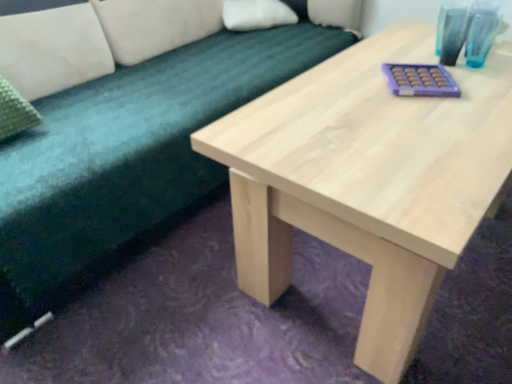
Question: From the image's perspective, relative to soft green fabric couch at upper left, is teal glass at upper right above or below?

Choices:
 (A) below
 (B) above

Answer: (B)

Question: Looking at their shapes, would you say teal glass at upper right is wider or thinner than soft green fabric couch at upper left?

Choices:
 (A) wide
 (B) thin

Answer: (B)

Question: Which object is the farthest from the white soft pillow at upper center?

Choices:
 (A) clear glass vase at upper right
 (B) natural wood table at center
 (C) soft green fabric couch at upper left
 (D) teal glass at upper right

Answer: (B)

Question: Which of these objects is positioned closest to the natural wood table at center?

Choices:
 (A) white soft pillow at upper center
 (B) soft green fabric couch at upper left
 (C) clear glass vase at upper right
 (D) teal glass at upper right

Answer: (C)